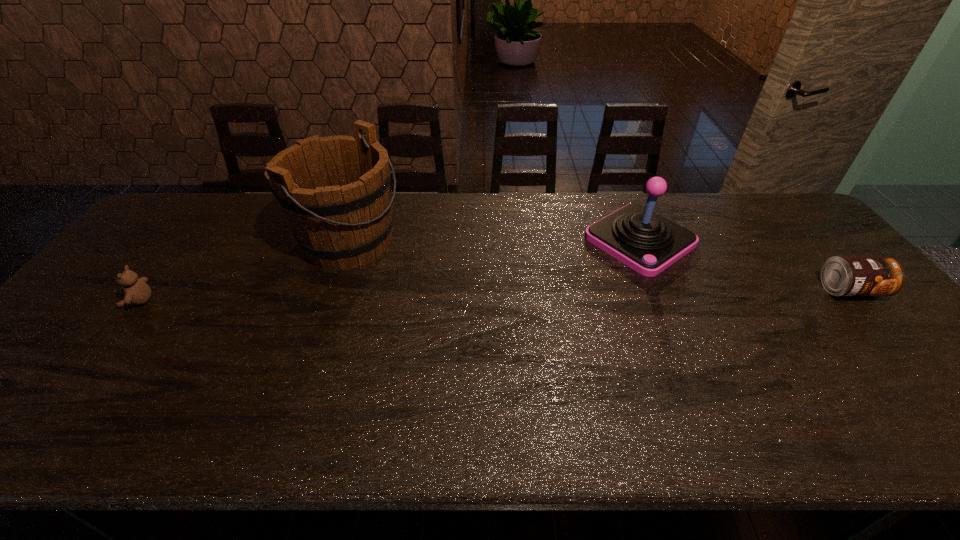
Where is `free space on the desktop that is between the teddy bear and the rightmost object and is positioned forward from the base of the second object from right to left`? free space on the desktop that is between the teddy bear and the rightmost object and is positioned forward from the base of the second object from right to left is located at coordinates (553, 295).

Identify the location of free space on the desktop that is between the leftmost object and the rightmost object and is positioned on the side of the tallest object with the handle for carrying. [472, 296].